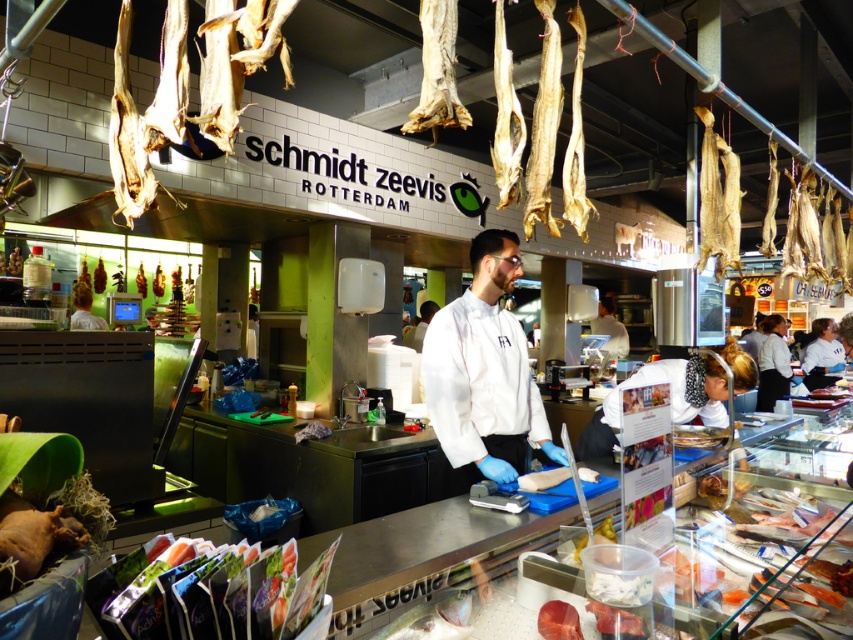
You are a customer at the Schmidt Zeevis Rotterdam fish market stall. You see two points marked in the scene. The first point is at coordinate (450, 413) and the second is at (86, 276). Which point is closer to you as you stand in front of the stall?

Point (450, 413) is in front of point (86, 276), so the first point is closer to you.

You are a customer at the Schmidt Zeevis Rotterdam fish market stall. You want to pick up the dried fish at upper center but you are standing at the white chef coat at center. Can you reach it without moving your feet?

The distance between the white chef coat at center and the dried fish at upper center is 5.44 meters. Since this distance is too far to reach without moving, you cannot pick up the dried fish at upper center while staying at the white chef coat at center.

You are a customer at the fish market stall. You see two points marked on the floor. One is at point (485,362) and the other at point (97,289). Which point is closer to you when you are standing at the entrance of the stall?

Point (485,362) is in front of point (97,289), so it is closer to you when you are standing at the entrance of the stall.